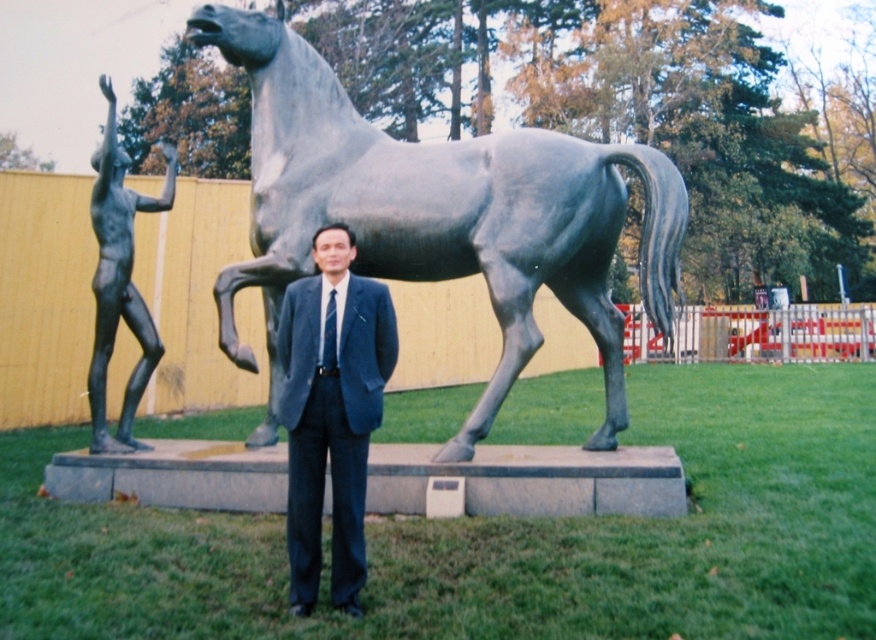
Question: Does bronze horse at center have a lesser width compared to blue fabric suit at center?

Choices:
 (A) no
 (B) yes

Answer: (A)

Question: Does bronze horse at center have a smaller size compared to blue fabric suit at center?

Choices:
 (A) no
 (B) yes

Answer: (A)

Question: Which of the following is the closest to the observer?

Choices:
 (A) (295, 579)
 (B) (126, 157)
 (C) (527, 211)

Answer: (A)

Question: Which object is closer to the camera taking this photo?

Choices:
 (A) bronze horse at center
 (B) black matte figure at left

Answer: (A)

Question: Does blue fabric suit at center have a lesser width compared to black matte figure at left?

Choices:
 (A) no
 (B) yes

Answer: (B)

Question: Among these points, which one is farthest from the camera?

Choices:
 (A) (318, 400)
 (B) (429, 196)

Answer: (B)